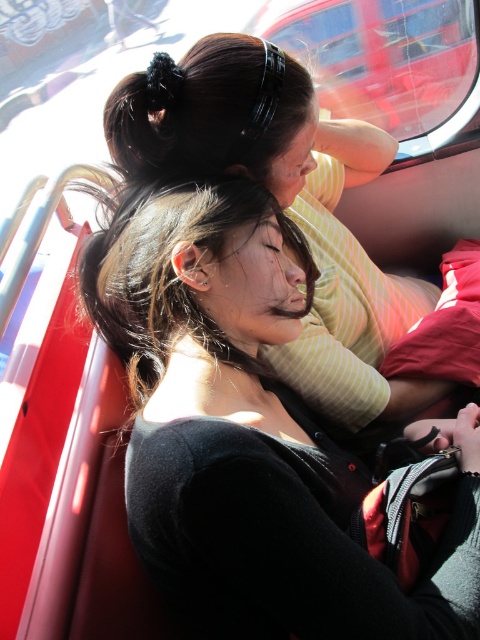
Question: Which point is farther to the camera?

Choices:
 (A) (240, 566)
 (B) (356, 152)

Answer: (B)

Question: Is black matte hair at center bigger than black matte hair at upper center?

Choices:
 (A) no
 (B) yes

Answer: (A)

Question: Does black matte hair at center appear over black matte hair at upper center?

Choices:
 (A) yes
 (B) no

Answer: (B)

Question: Which point is closer to the camera?

Choices:
 (A) black matte hair at upper center
 (B) black matte hair at center

Answer: (B)

Question: Can you confirm if black matte hair at center is positioned to the left of black matte hair at upper center?

Choices:
 (A) no
 (B) yes

Answer: (B)